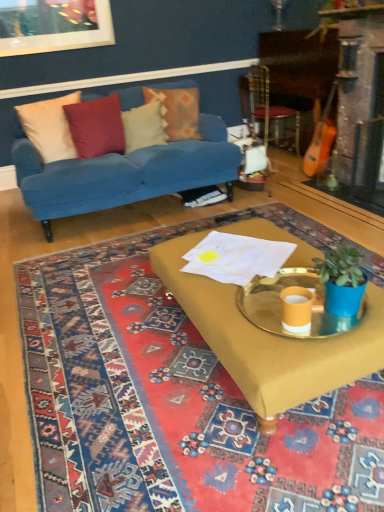
What are the coordinates of `vacant area situated to the left side of blue matte plant pot at right` in the screenshot? It's located at (272, 310).